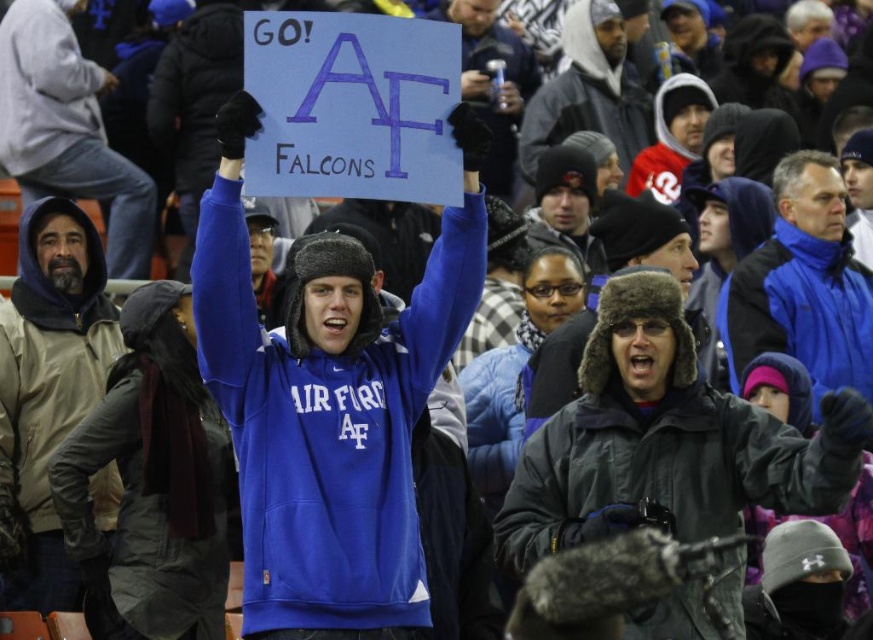
You are standing in the crowd at the football game and want to take a photo of both the point at coordinates point (857, 422) and point (588, 125). Which point should you focus on first to ensure both are in focus?

You should focus on point (857, 422) first because it is closer to the camera than point (588, 125), ensuring both points are within the depth of field.